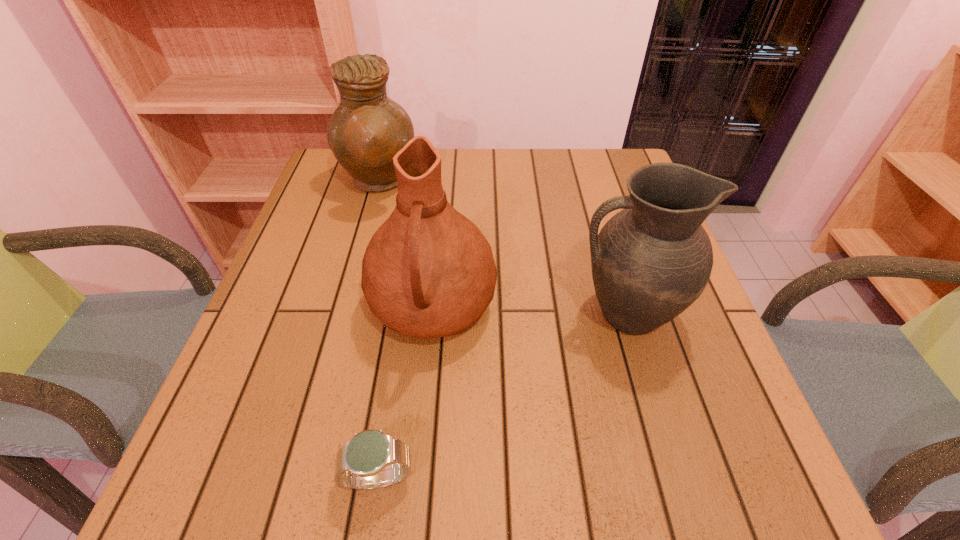
Identify the location of free location that satisfies the following two spatial constraints: 1. on the side of the rightmost pitcher with the handle; 2. on the front side of the watch. (673, 478).

Locate an element on the screen. The width and height of the screenshot is (960, 540). free space that satisfies the following two spatial constraints: 1. at the spout of the farthest object; 2. on the right side of the watch is located at coordinates point(296,478).

This screenshot has width=960, height=540. I want to click on vacant region that satisfies the following two spatial constraints: 1. on the back side of the watch; 2. at the spout of the farthest object, so click(x=424, y=183).